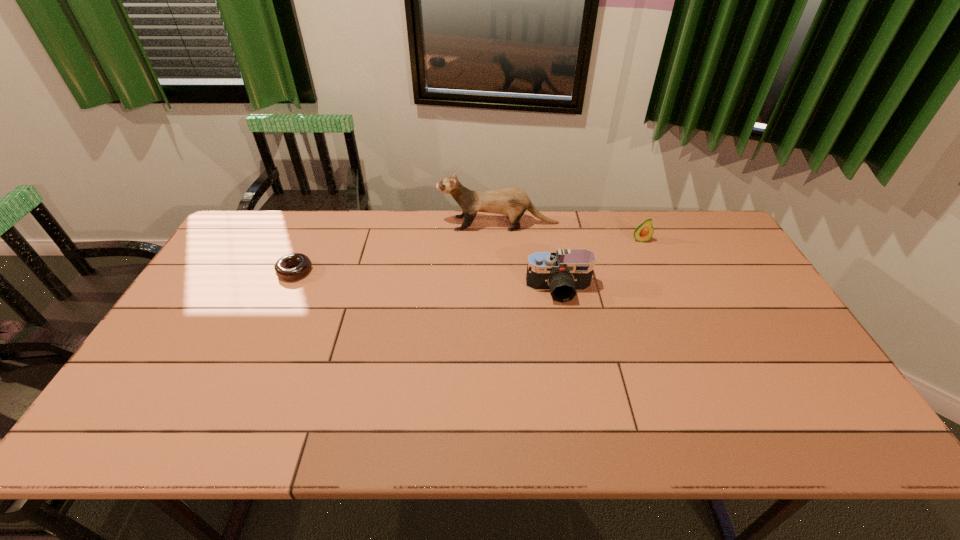
This screenshot has width=960, height=540. In order to click on free space located on the front-facing side of the camera in this screenshot , I will do `click(571, 359)`.

Find the location of a particular element. Image resolution: width=960 pixels, height=540 pixels. free spot located 0.190m on the cut side of the third tallest object is located at coordinates (659, 283).

Identify the location of vacant area situated on the back of the leftmost object. (318, 221).

Locate an element on the screen. ferret present at the far edge is located at coordinates (513, 202).

Locate an element on the screen. The height and width of the screenshot is (540, 960). avocado at the far edge is located at coordinates (644, 232).

I want to click on vacant region at the far edge of the desktop, so click(x=458, y=246).

The image size is (960, 540). I want to click on vacant space at the near edge of the desktop, so click(718, 425).

Identify the location of free space at the right edge of the desktop. This screenshot has width=960, height=540. (711, 275).

Where is `vacant space at the near left corner of the desktop`? Image resolution: width=960 pixels, height=540 pixels. vacant space at the near left corner of the desktop is located at coordinates (163, 433).

In the image, there is a desktop. Identify the location of vacant region at the far right corner. pos(719,235).